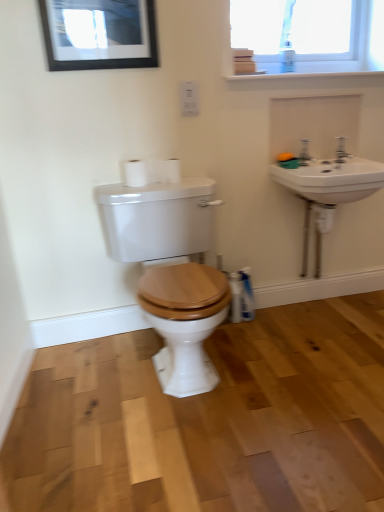
The height and width of the screenshot is (512, 384). What are the coordinates of `vacant space in wooden toilet seat at center (from a real-world perspective)` in the screenshot? It's located at (162, 382).